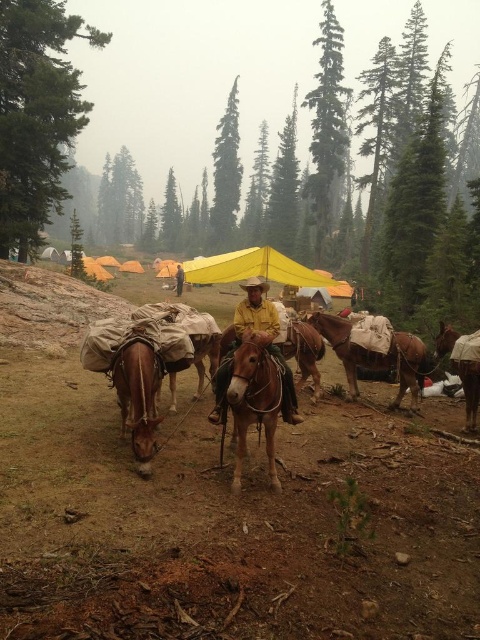
Is point (216, 410) closer to camera compared to point (269, 262)?

Yes.

Between point (292, 388) and point (298, 284), which one is positioned in front?

Point (292, 388)

Locate an element on the screen. Image resolution: width=480 pixels, height=640 pixels. yellow matte shirt at center is located at coordinates (260, 339).

Does point (446, 342) come farther from viewer compared to point (179, 285)?

No, it is in front of (179, 285).

What are the coordinates of `brown leather saddle at lower right` in the screenshot? It's located at (463, 368).

Where is `brown leather saddle at lower right`? The height and width of the screenshot is (640, 480). brown leather saddle at lower right is located at coordinates (463, 368).

You are a GUI agent. You are given a task and a screenshot of the screen. Output one action in this format:
    pyautogui.click(x=<x>, y=<y>)
    Task: Click on the brown leather saddle at lower right
    The width and height of the screenshot is (480, 640).
    Given the screenshot: What is the action you would take?
    pyautogui.click(x=463, y=368)

Can you confirm if brown leather saddle at center is bigger than yellow matte shirt at center?

Yes, brown leather saddle at center is bigger than yellow matte shirt at center.

Based on the photo, can you confirm if brown leather saddle at center is shorter than yellow matte shirt at center?

In fact, brown leather saddle at center may be taller than yellow matte shirt at center.

Is point (335, 323) more distant than point (227, 378)?

Yes, it is behind point (227, 378).

Locate an element on the screen. brown leather saddle at center is located at coordinates (376, 356).